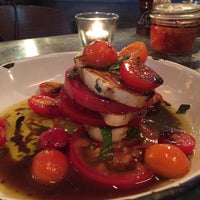
Where is `glass cup`? This screenshot has width=200, height=200. glass cup is located at coordinates (106, 22).